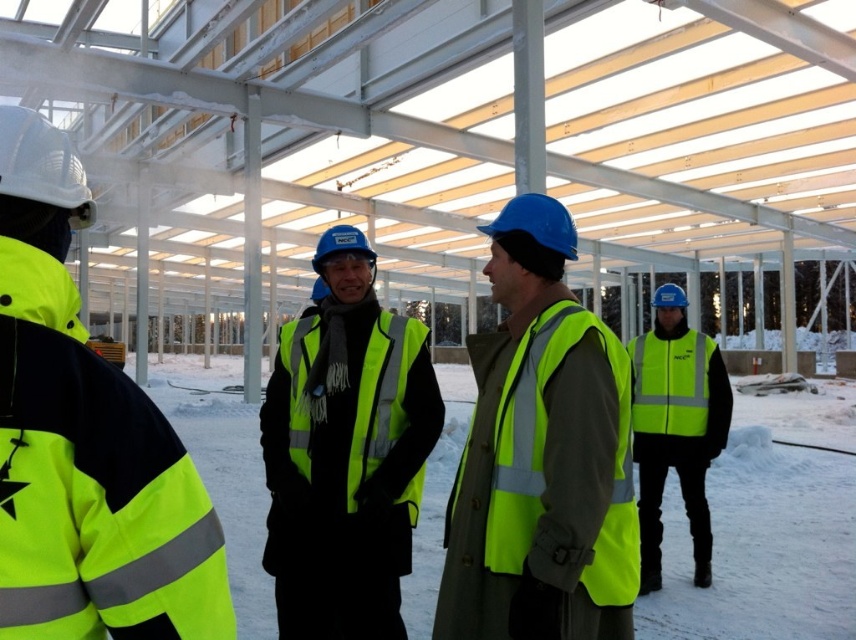
Where is `high-visibility fabric safety vest at center`? The image size is (856, 640). high-visibility fabric safety vest at center is located at coordinates (381, 396).

How distant is high-visibility fabric safety vest at center from high-visibility fabric safety vest at center-right?

high-visibility fabric safety vest at center and high-visibility fabric safety vest at center-right are 2.05 meters apart from each other.

Is point (355, 410) farther from camera compared to point (667, 349)?

That is False.

The width and height of the screenshot is (856, 640). Identify the location of high-visibility fabric safety vest at center. (381, 396).

Is point (34, 205) in front of point (714, 448)?

Yes, it is.

Between neon yellow reflective jacket at left and high visibility yellow vest at center, which one is positioned lower?

Positioned lower is high visibility yellow vest at center.

The width and height of the screenshot is (856, 640). Find the location of `neon yellow reflective jacket at left`. neon yellow reflective jacket at left is located at coordinates (85, 442).

Can you confirm if high-visibility fabric vest at center is positioned to the right of high visibility yellow vest at center?

Incorrect, high-visibility fabric vest at center is not on the right side of high visibility yellow vest at center.

Who is more distant from viewer, [357,634] or [688,372]?

Positioned behind is point [688,372].

What do you see at coordinates (346, 454) in the screenshot?
I see `high-visibility fabric vest at center` at bounding box center [346, 454].

At what (x,y) coordinates should I click in order to perform the action: click on high-visibility fabric vest at center. Please return your answer as a coordinate pair (x, y). Looking at the image, I should click on (346, 454).